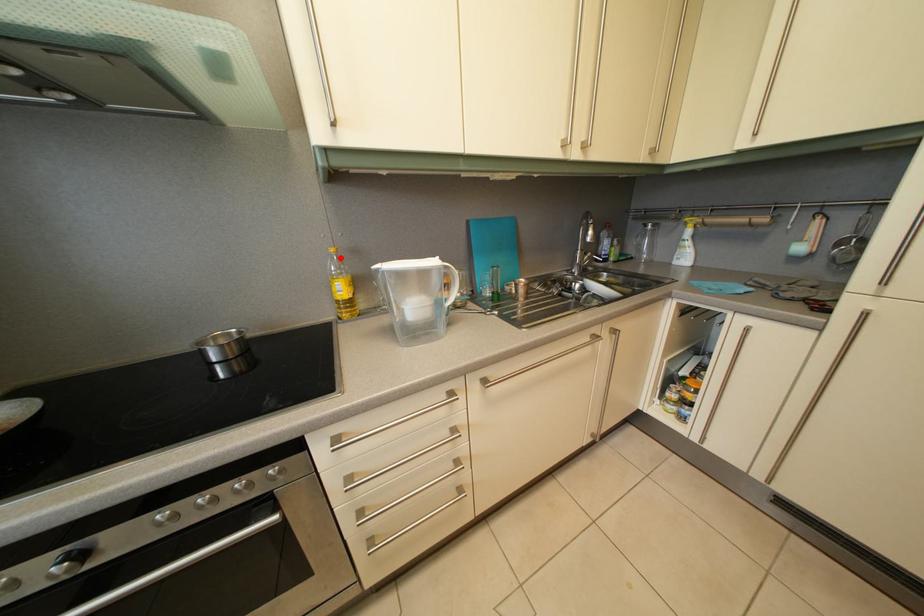
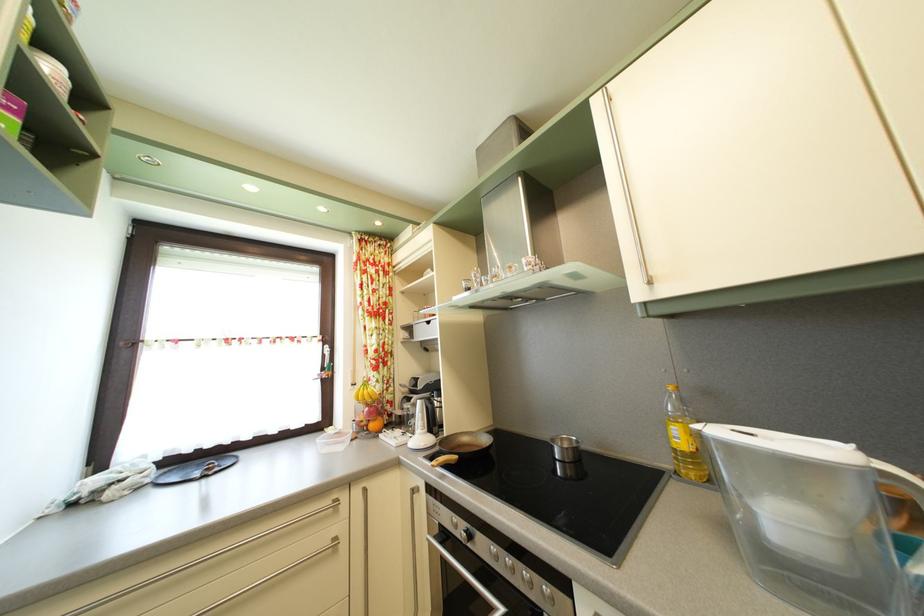
The point at the highlighted location is marked in the first image. Where is the corresponding point in the second image?

(678, 395)